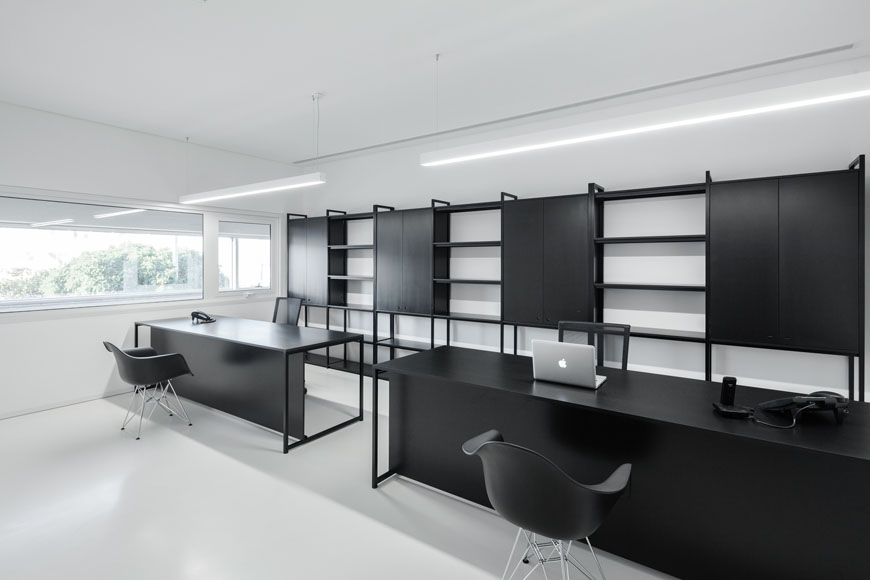
At what (x,y) coordinates should I click in order to perform the action: click on shelve. Please return your answer as a coordinate pair (x, y). Image resolution: width=870 pixels, height=580 pixels. Looking at the image, I should click on (627, 264).